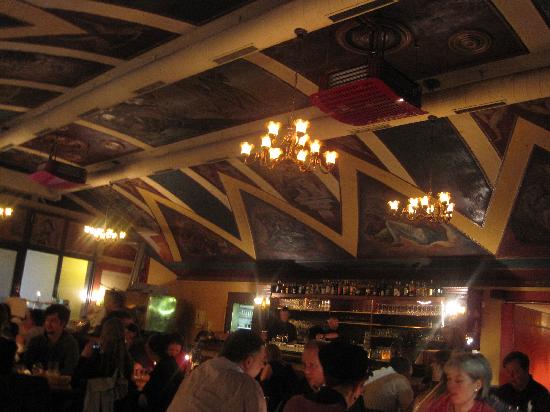
Locate an element on the screen. tables is located at coordinates (36, 299).